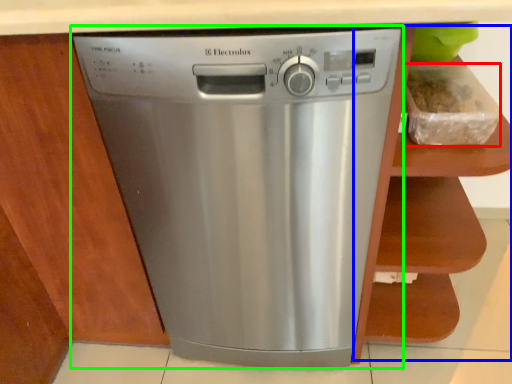
Question: Which is nearer to the food (highlighted by a red box)? cabinet (highlighted by a blue box) or home appliance (highlighted by a green box).

Choices:
 (A) cabinet
 (B) home appliance

Answer: (A)